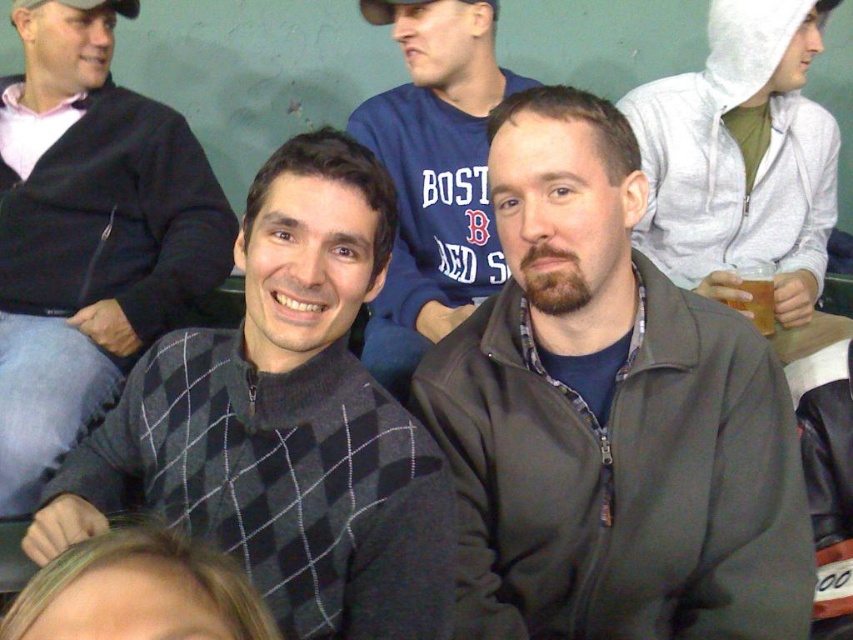
Identify the location of dark gray zip-up jacket at center. The width and height of the screenshot is (853, 640). (608, 417).

Does dark gray zip-up jacket at center have a greater width compared to white zip-up hoodie at upper right?

Incorrect, dark gray zip-up jacket at center's width does not surpass white zip-up hoodie at upper right's.

Locate an element on the screen. The image size is (853, 640). dark gray zip-up jacket at center is located at coordinates (608, 417).

Locate an element on the screen. The image size is (853, 640). dark gray zip-up jacket at center is located at coordinates (608, 417).

Does dark gray argyle sweater at center have a larger size compared to dark gray argyle sweater at left?

No, dark gray argyle sweater at center is not bigger than dark gray argyle sweater at left.

Who is more forward, (x=177, y=417) or (x=51, y=83)?

Point (x=177, y=417)

Locate an element on the screen. This screenshot has height=640, width=853. dark gray argyle sweater at center is located at coordinates (283, 422).

Between white zip-up hoodie at upper right and dark gray sweater at center, which one is positioned higher?

white zip-up hoodie at upper right

Locate an element on the screen. This screenshot has width=853, height=640. white zip-up hoodie at upper right is located at coordinates (741, 156).